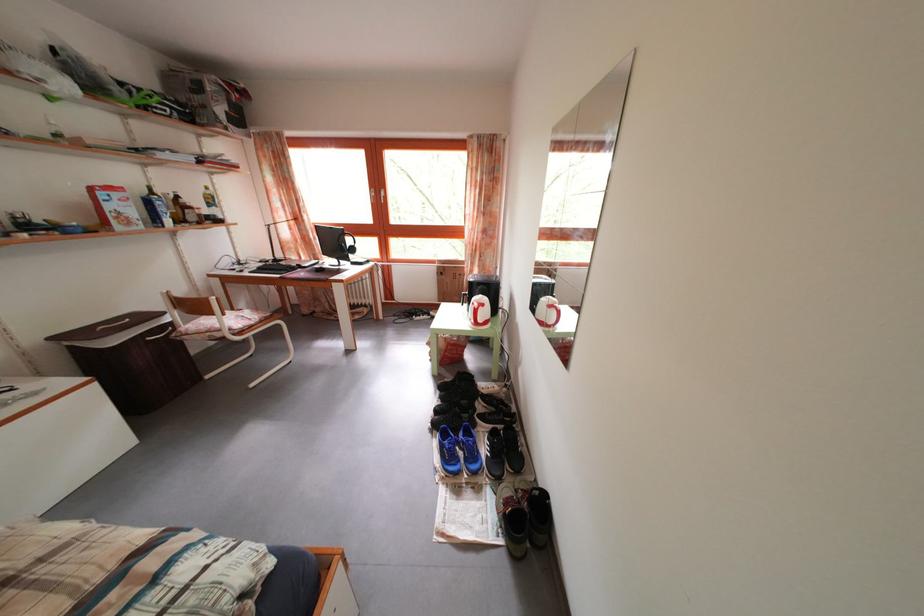
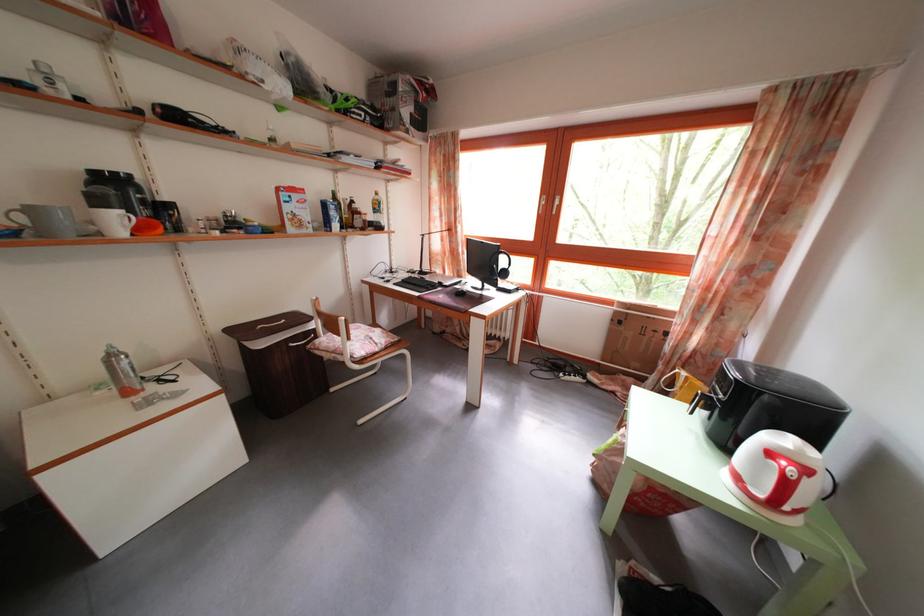
Find the pixel in the second image that matches point 312,275 in the first image.

(454, 294)